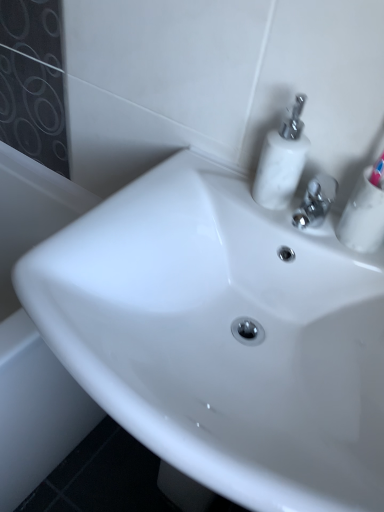
Question: From a real-world perspective, relative to white glossy soap dispenser at upper right, is white glossy mouthwash at upper right vertically above or below?

Choices:
 (A) above
 (B) below

Answer: (B)

Question: Is point (349, 211) positioned closer to the camera than point (259, 203)?

Choices:
 (A) farther
 (B) closer

Answer: (B)

Question: Which is farther from the white glossy mouthwash at upper right?

Choices:
 (A) white glossy sink at center
 (B) white glossy bath at lower left
 (C) white glossy soap dispenser at upper right

Answer: (B)

Question: Which of these objects is positioned farthest from the white glossy mouthwash at upper right?

Choices:
 (A) white glossy sink at center
 (B) white glossy bath at lower left
 (C) white glossy soap dispenser at upper right

Answer: (B)